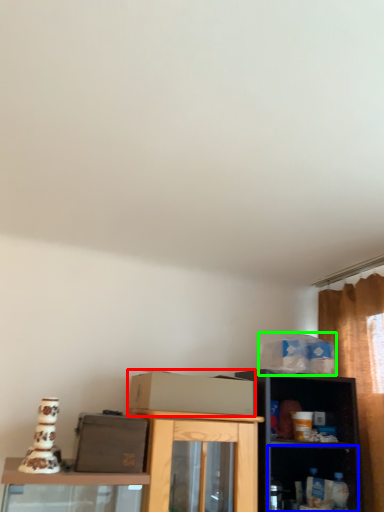
Question: Which object is the farthest from cardboard box (highlighted by a red box)? Choose among these: shelf (highlighted by a blue box) or box (highlighted by a green box).

Choices:
 (A) shelf
 (B) box

Answer: (A)